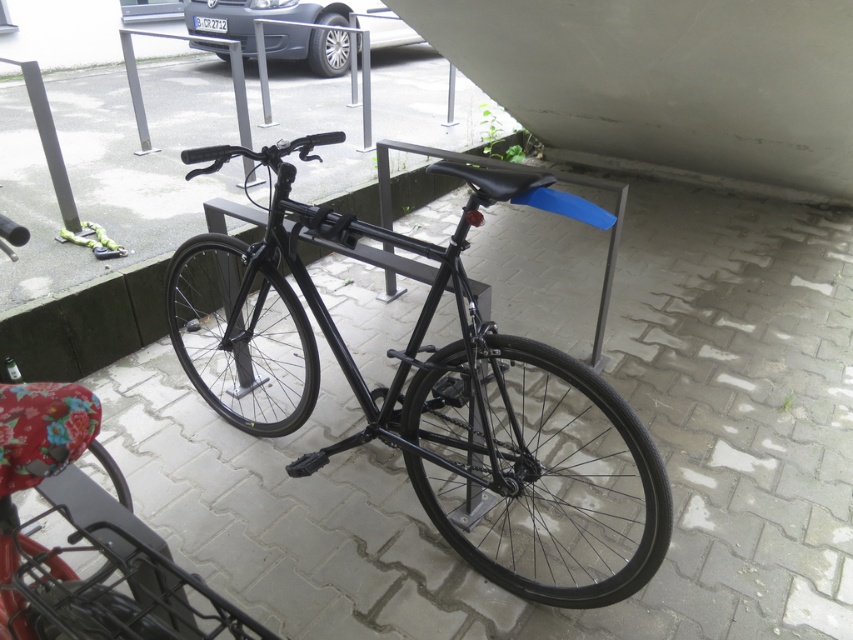
You are standing at the point marked as point [437,397] and want to find the black matte bicycle at center. According to the scene description, where would you look relative to your current position?

The black matte bicycle at center is located exactly at your current position since you are standing at point [437,397] where the bicycle is situated.

You are standing at the parking area and want to move your bicycle to a spot closer to the car. Based on their positions, can you estimate whether the black matte bicycle at center is positioned below the silver metallic car at upper center?

The black matte bicycle at center is below the silver metallic car at upper center, so moving it closer would require positioning it under the car, which isn not feasible. Choose another spot.